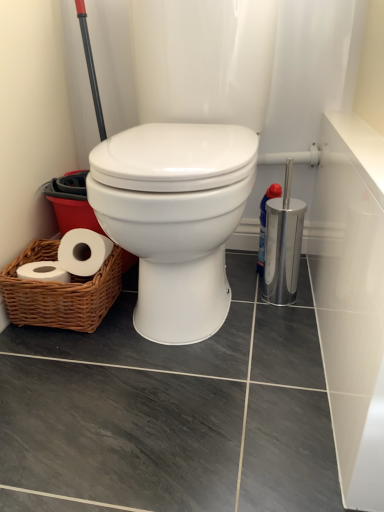
Find the location of a particular element. The width and height of the screenshot is (384, 512). vacant space in front of white glossy toilet at center is located at coordinates (186, 361).